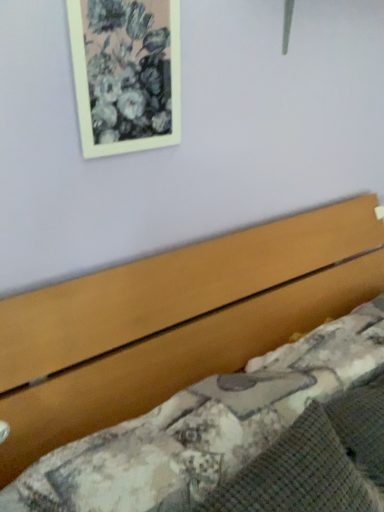
Where is `matte white picture frame at upper left`? matte white picture frame at upper left is located at coordinates (126, 74).

What do you see at coordinates (126, 74) in the screenshot? This screenshot has height=512, width=384. I see `matte white picture frame at upper left` at bounding box center [126, 74].

Measure the distance between point (x=253, y=302) and camera.

3.98 feet.

The image size is (384, 512). What do you see at coordinates (174, 322) in the screenshot?
I see `wooden bed at lower right` at bounding box center [174, 322].

Identify the location of wooden bed at lower right. The width and height of the screenshot is (384, 512). (174, 322).

At what (x,y) coordinates should I click in order to perform the action: click on matte white picture frame at upper left. Please return your answer as a coordinate pair (x, y). The image size is (384, 512). Looking at the image, I should click on (126, 74).

Which object is positioned more to the right, wooden bed at lower right or matte white picture frame at upper left?

wooden bed at lower right is more to the right.

Which object is further away from the camera taking this photo, wooden bed at lower right or matte white picture frame at upper left?

matte white picture frame at upper left.

Is point (1, 344) behind point (82, 120)?

Yes, point (1, 344) is farther from viewer.

From the image's perspective, is wooden bed at lower right located beneath matte white picture frame at upper left?

Indeed, from the image's perspective, wooden bed at lower right is shown beneath matte white picture frame at upper left.

From a real-world perspective, which object stands above the other?

matte white picture frame at upper left.

Between wooden bed at lower right and matte white picture frame at upper left, which one has larger width?

With larger width is wooden bed at lower right.

Considering the relative sizes of wooden bed at lower right and matte white picture frame at upper left in the image provided, is wooden bed at lower right taller than matte white picture frame at upper left?

Correct, wooden bed at lower right is much taller as matte white picture frame at upper left.

Does wooden bed at lower right have a larger size compared to matte white picture frame at upper left?

Yes.

Is wooden bed at lower right situated inside matte white picture frame at upper left or outside?

The correct answer is: outside.

Does wooden bed at lower right touch matte white picture frame at upper left?

No.

Is wooden bed at lower right facing away from matte white picture frame at upper left?

No, wooden bed at lower right's orientation is not away from matte white picture frame at upper left.

How many degrees apart are the facing directions of wooden bed at lower right and matte white picture frame at upper left?

The facing directions of wooden bed at lower right and matte white picture frame at upper left are 0.0167 degrees apart.

This screenshot has width=384, height=512. Find the location of `picture frame above the wooden bed at lower right (from a real-world perspective)`. picture frame above the wooden bed at lower right (from a real-world perspective) is located at coordinates (126, 74).

Which is more to the right, matte white picture frame at upper left or wooden bed at lower right?

wooden bed at lower right is more to the right.

Is the depth of matte white picture frame at upper left less than that of wooden bed at lower right?

No, it is not.

Is point (119, 32) closer to camera compared to point (100, 364)?

Yes.

From the image's perspective, which one is positioned higher, matte white picture frame at upper left or wooden bed at lower right?

matte white picture frame at upper left.

Based on the photo, from a real-world perspective, who is located lower, matte white picture frame at upper left or wooden bed at lower right?

wooden bed at lower right is physically lower.

Which object is thinner, matte white picture frame at upper left or wooden bed at lower right?

With smaller width is matte white picture frame at upper left.

Considering the relative sizes of matte white picture frame at upper left and wooden bed at lower right in the image provided, is matte white picture frame at upper left shorter than wooden bed at lower right?

Yes, matte white picture frame at upper left is shorter than wooden bed at lower right.

Considering the sizes of objects matte white picture frame at upper left and wooden bed at lower right in the image provided, who is smaller, matte white picture frame at upper left or wooden bed at lower right?

Smaller between the two is matte white picture frame at upper left.

Would you say matte white picture frame at upper left contains wooden bed at lower right?

No, wooden bed at lower right is not inside matte white picture frame at upper left.

Would you say matte white picture frame at upper left is a long distance from wooden bed at lower right?

No, there isn't a large distance between matte white picture frame at upper left and wooden bed at lower right.

From the picture: Is matte white picture frame at upper left looking in the opposite direction of wooden bed at lower right?

No, matte white picture frame at upper left is not facing the opposite direction of wooden bed at lower right.

How different are the orientations of matte white picture frame at upper left and wooden bed at lower right in degrees?

The facing directions of matte white picture frame at upper left and wooden bed at lower right are 0.0167 degrees apart.

In the scene shown: Measure the distance between matte white picture frame at upper left and wooden bed at lower right.

matte white picture frame at upper left and wooden bed at lower right are 19.36 inches apart.

You are a GUI agent. You are given a task and a screenshot of the screen. Output one action in this format:
    pyautogui.click(x=<x>, y=<y>)
    Task: Click on the picture frame on the left of wooden bed at lower right
    
    Given the screenshot: What is the action you would take?
    pyautogui.click(x=126, y=74)

I want to click on bed lying below the matte white picture frame at upper left (from the image's perspective), so click(x=174, y=322).

Image resolution: width=384 pixels, height=512 pixels. What are the coordinates of `picture frame above the wooden bed at lower right (from a real-world perspective)` in the screenshot? It's located at (126, 74).